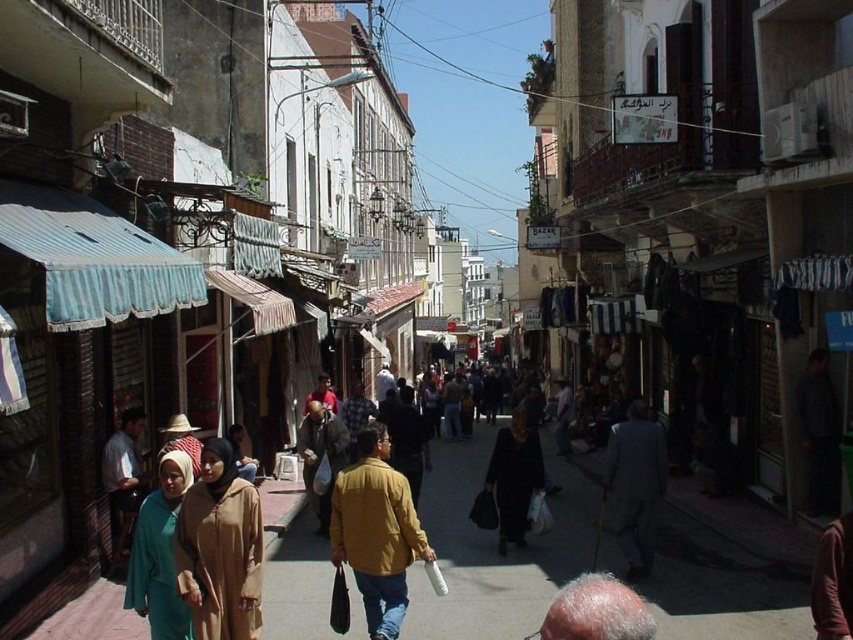
Question: Is teal fabric hijab at center thinner than dark gray suit at center?

Choices:
 (A) yes
 (B) no

Answer: (A)

Question: Which point appears farthest from the camera in this image?

Choices:
 (A) (398, 584)
 (B) (601, 580)
 (C) (119, 452)

Answer: (C)

Question: Which point is farther from the camera taking this photo?

Choices:
 (A) (209, 608)
 (B) (109, 506)

Answer: (B)

Question: Which of these objects is positioned farthest from the gray hair at lower center?

Choices:
 (A) light brown fabric hijab at center
 (B) matte beige abaya at center
 (C) black matte dress at center

Answer: (C)

Question: Is teal fabric hijab at center wider than dark gray suit at center?

Choices:
 (A) no
 (B) yes

Answer: (A)

Question: Does dark gray suit at center appear on the right side of gray hair at lower center?

Choices:
 (A) yes
 (B) no

Answer: (A)